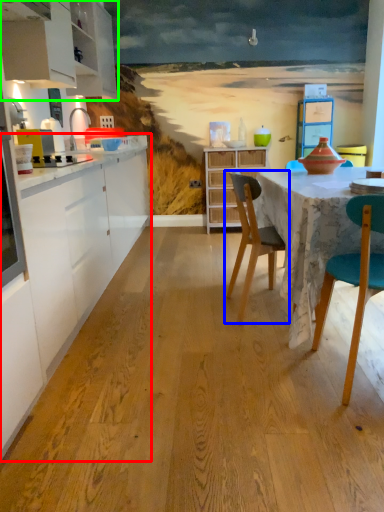
Question: Which object is positioned farthest from countertop (highlighted by a red box)? Select from chair (highlighted by a blue box) and cabinetry (highlighted by a green box).

Choices:
 (A) chair
 (B) cabinetry

Answer: (B)